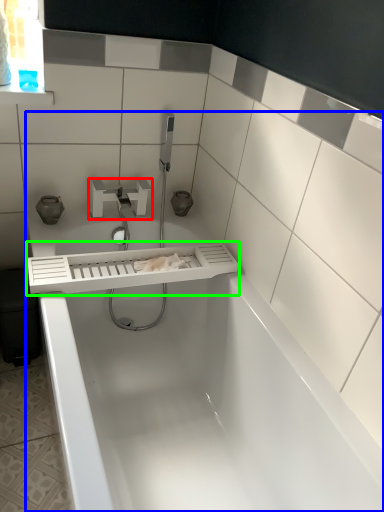
Question: Which object is the farthest from tap (highlighted by a red box)? Choose among these: bathtub (highlighted by a blue box) or balustrade (highlighted by a green box).

Choices:
 (A) bathtub
 (B) balustrade

Answer: (A)